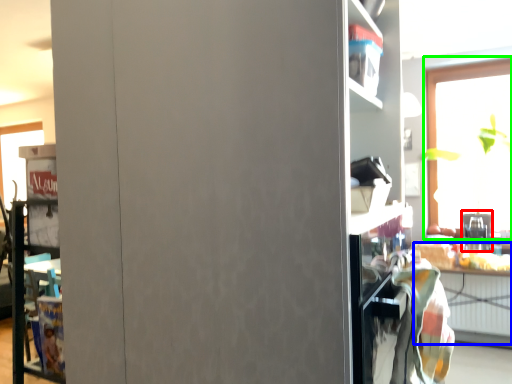
Question: Estimate the real-world distances between objects in this image. Which object is closer to appliance (highlighted by a red box), table (highlighted by a blue box) or window (highlighted by a green box)?

Choices:
 (A) table
 (B) window

Answer: (A)